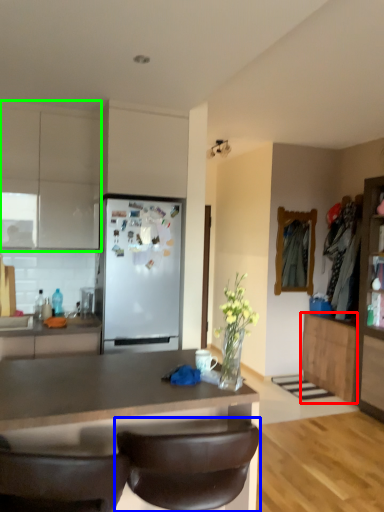
Question: Which object is the farthest from cabinetry (highlighted by a red box)? Choose among these: chair (highlighted by a blue box) or cabinetry (highlighted by a green box).

Choices:
 (A) chair
 (B) cabinetry

Answer: (B)